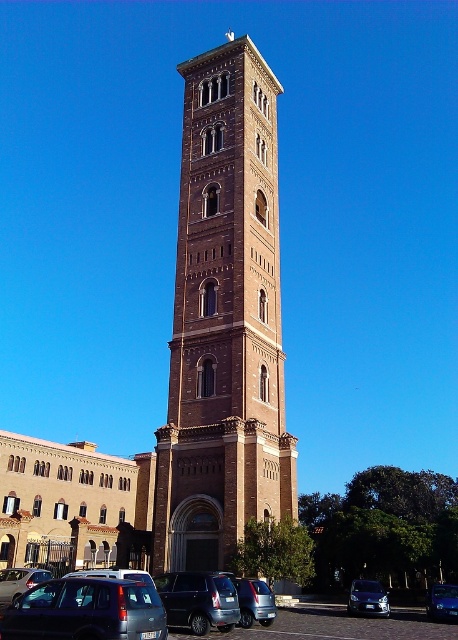
You are standing at the base of the bell tower and want to park your car in the closest available spot. The metallic blue sedan at lower center is represented by point (367,598). Which direction should you drive to reach the closest parking spot?

The closest parking spot is directly in front of the metallic blue sedan at lower center, so you should drive straight ahead towards point (367,598).

You are a photographer trying to capture the entire brown brick tower at center and metallic gray van at lower left in a single frame. Based on their sizes in the image, which object should you focus on to ensure both are fully visible?

The brown brick tower at center is taller than the metallic gray van at lower left, so you should focus on the tower to ensure both are fully visible in the frame.

In the scene shown: You are a photographer planning to take a wide shot of the brown brick tower at center and the metallic gray van at lower left. Based on their positions, which object would appear larger in the photo?

The brown brick tower at center would appear larger in the photo because it is wider than the metallic gray van at lower left according to the description.